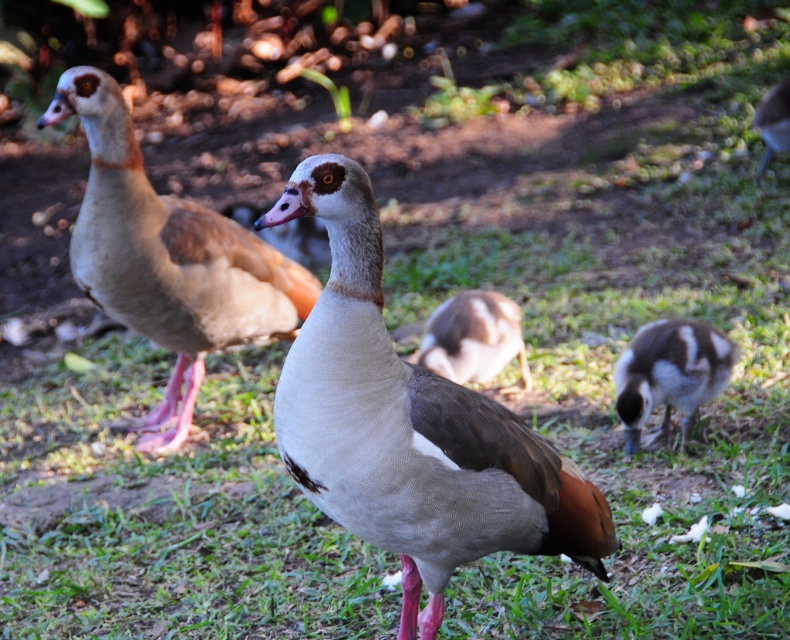
Question: Considering the relative positions of brown feathered duck at left and brown matte duckling at lower right in the image provided, where is brown feathered duck at left located with respect to brown matte duckling at lower right?

Choices:
 (A) below
 (B) above

Answer: (A)

Question: Which point is closer to the camera taking this photo?

Choices:
 (A) (418, 516)
 (B) (450, 304)
 (C) (615, 408)
 (D) (781, 106)

Answer: (A)

Question: Can you confirm if matte brown duck at center is smaller than brown feathered duckling at center?

Choices:
 (A) yes
 (B) no

Answer: (B)

Question: Can you confirm if matte brown duck at center is positioned to the left of brown feathered duck at left?

Choices:
 (A) no
 (B) yes

Answer: (A)

Question: Considering the real-world distances, which object is closest to the brown feathered duck at left?

Choices:
 (A) brown downy duckling at lower right
 (B) brown matte duckling at lower right

Answer: (A)

Question: Which of the following is the farthest from the observer?

Choices:
 (A) (491, 362)
 (B) (158, 300)
 (C) (753, 125)

Answer: (C)